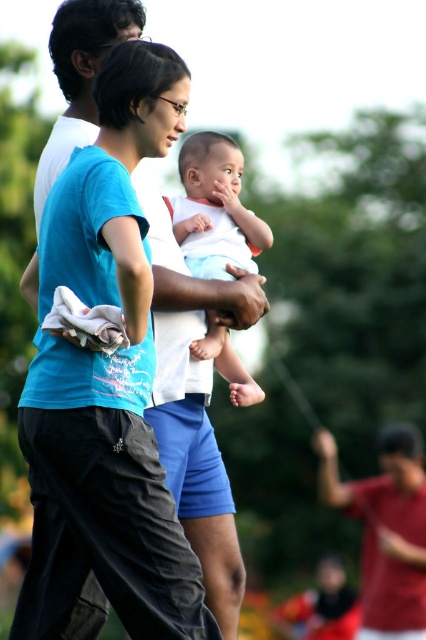
In the scene described, you notice a red shirt at center and a white soft baby at center. According to the spatial arrangement, which object is positioned to the right of the other?

The red shirt at center is to the right of the white soft baby at center.

From the picture: Imagine you are standing at the point labeled point [204,244] and you want to walk to the point labeled point [423,518]. Based on the scene description, will you be moving towards the background or the foreground?

Since point [423,518] is behind point [204,244], moving from point [204,244] to point [423,518] means you are moving towards the background.

Consider the image. You are standing at the camera position and want to throw a ball to the point marked as point [140,612]. Is the distance within your throwing range of 5 meters?

The distance between point [140,612] and the camera is 5.26 meters, which exceeds the throwing range of 5 meters. Therefore, you cannot reach it with a throw.